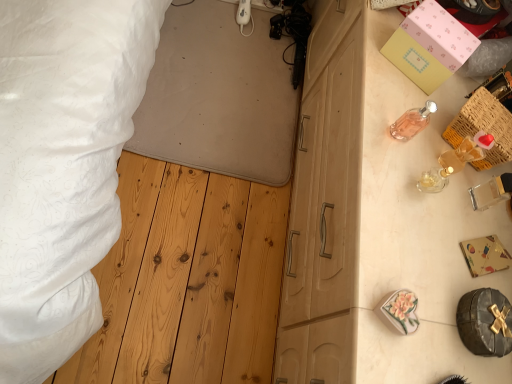
Locate an element on the screen. free space to the left of pink glass perfume at upper right is located at coordinates (368, 99).